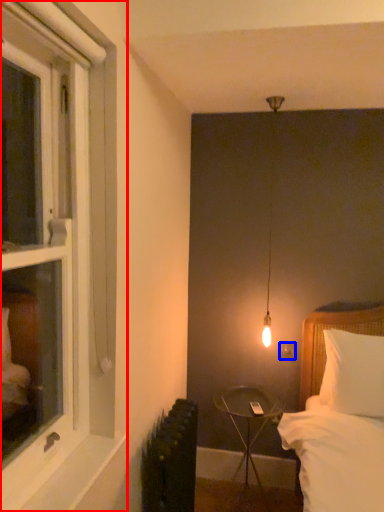
Question: Among these objects, which one is farthest to the camera, window (highlighted by a red box) or electric outlet (highlighted by a blue box)?

Choices:
 (A) window
 (B) electric outlet

Answer: (B)